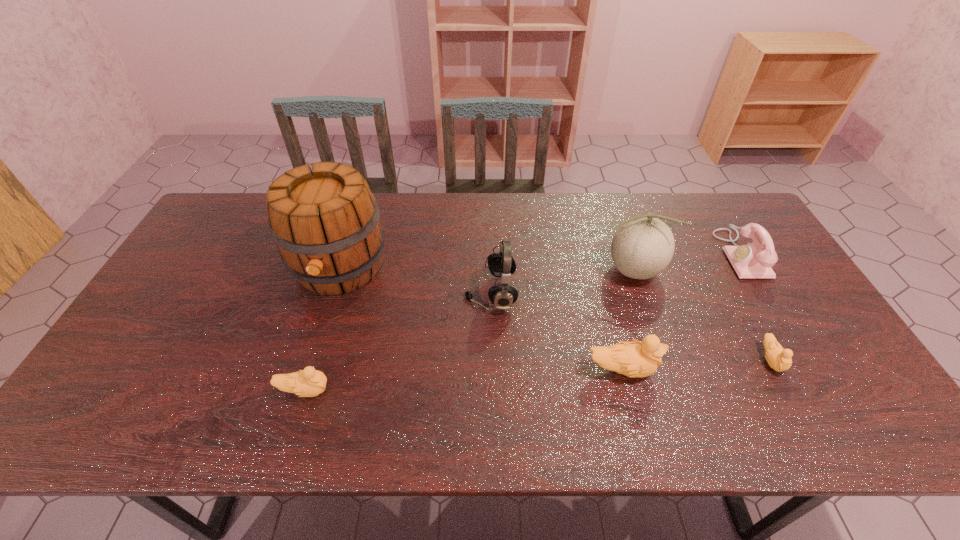
Where is `vacant position for inserting another duckling evenly`? vacant position for inserting another duckling evenly is located at coordinates (466, 380).